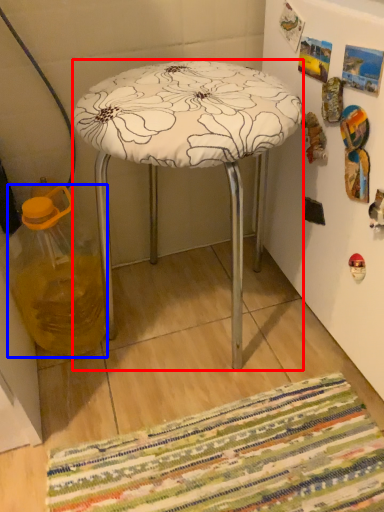
Question: Which of the following is the farthest to the observer, stool (highlighted by a red box) or glass jar (highlighted by a blue box)?

Choices:
 (A) stool
 (B) glass jar

Answer: (B)